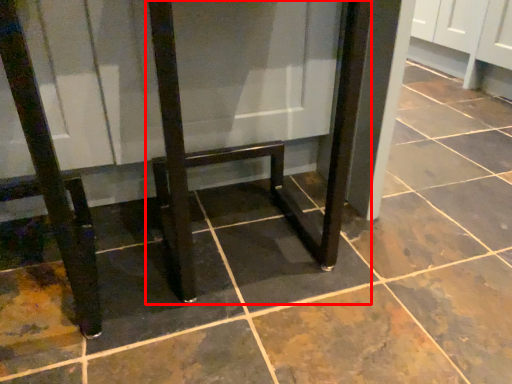
Question: Considering the relative positions of furniture (annotated by the red box) and furniture in the image provided, where is furniture (annotated by the red box) located with respect to the staircase?

Choices:
 (A) right
 (B) left

Answer: (A)